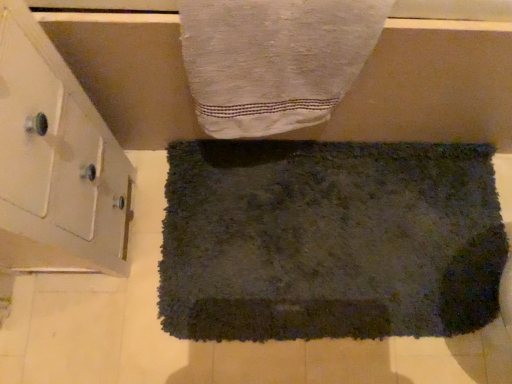
Question: Considering the positions of white glossy cabinet at left and dark gray shaggy rug at center, positioned as the first towel in back-to-front order, in the image, is white glossy cabinet at left bigger or smaller than dark gray shaggy rug at center, positioned as the first towel in back-to-front order,?

Choices:
 (A) big
 (B) small

Answer: (A)

Question: Based on their positions, is white glossy cabinet at left located to the left or right of dark gray shaggy rug at center, which appears as the 1th towel when ordered from the bottom?

Choices:
 (A) left
 (B) right

Answer: (A)

Question: Estimate the real-world distances between objects in this image. Which object is farther from the white glossy cabinet at left?

Choices:
 (A) white textured towel at upper center, placed as the second towel when sorted from back to front
 (B) dark gray shaggy rug at center, which is counted as the 2th towel, starting from the top

Answer: (B)

Question: Which is farther from the dark gray shaggy rug at center, arranged as the second towel when viewed from the front?

Choices:
 (A) white glossy cabinet at left
 (B) white textured towel at upper center, placed as the second towel when sorted from back to front

Answer: (A)